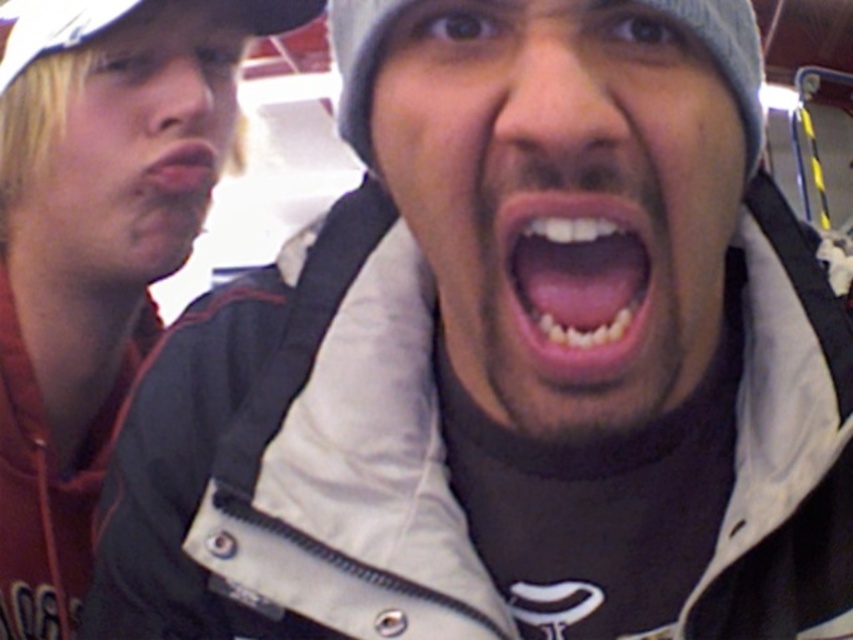
Question: Does matte black jacket at left appear over matte skin at center?

Choices:
 (A) no
 (B) yes

Answer: (A)

Question: Estimate the real-world distances between objects in this image. Which object is closer to the matte skin at center?

Choices:
 (A) teeth at center
 (B) gray woolen hat at center
 (C) blonde hair at left
 (D) gray knit cap at center

Answer: (C)

Question: Does matte black jacket at left have a greater width compared to matte skin at center?

Choices:
 (A) no
 (B) yes

Answer: (B)

Question: Is blonde hair at left smaller than matte skin at center?

Choices:
 (A) no
 (B) yes

Answer: (A)

Question: Which point is farther to the camera?

Choices:
 (A) (442, 291)
 (B) (525, 228)
 (C) (142, 248)

Answer: (C)

Question: Which point is closer to the camera?

Choices:
 (A) (160, 182)
 (B) (370, 154)
 (C) (550, 275)
 (D) (102, 29)

Answer: (C)